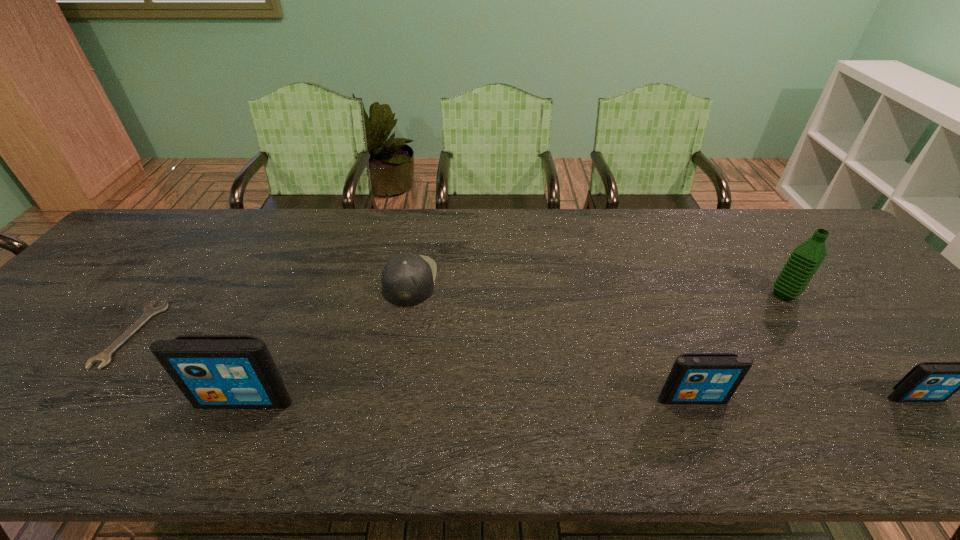
The image size is (960, 540). Find the location of `vacant space that is in between the rightmost object and the second iPod from left to right`. vacant space that is in between the rightmost object and the second iPod from left to right is located at coordinates (804, 398).

Where is `free space between the tallest iPod and the cap`? free space between the tallest iPod and the cap is located at coordinates (327, 340).

Find the location of `empty space between the water bottle and the second iPod from right to left`. empty space between the water bottle and the second iPod from right to left is located at coordinates (738, 346).

Identify the location of free space between the shortest object and the water bottle. The image size is (960, 540). (458, 314).

This screenshot has width=960, height=540. Find the location of `free space between the cap and the water bottle`. free space between the cap and the water bottle is located at coordinates (597, 287).

Locate an element on the screen. This screenshot has width=960, height=540. empty space between the shortest object and the water bottle is located at coordinates click(458, 314).

Where is `vacant area between the fourth object from right to left and the leftmost object`? vacant area between the fourth object from right to left and the leftmost object is located at coordinates pos(271,307).

Find the location of a particular element. The height and width of the screenshot is (540, 960). free space between the rightmost object and the water bottle is located at coordinates (850, 346).

Identify the location of free space between the fifth object from left to right and the fourth shortest object. The width and height of the screenshot is (960, 540). (738, 346).

The height and width of the screenshot is (540, 960). Identify the location of object that stands as the closest to the wrench. (x=212, y=371).